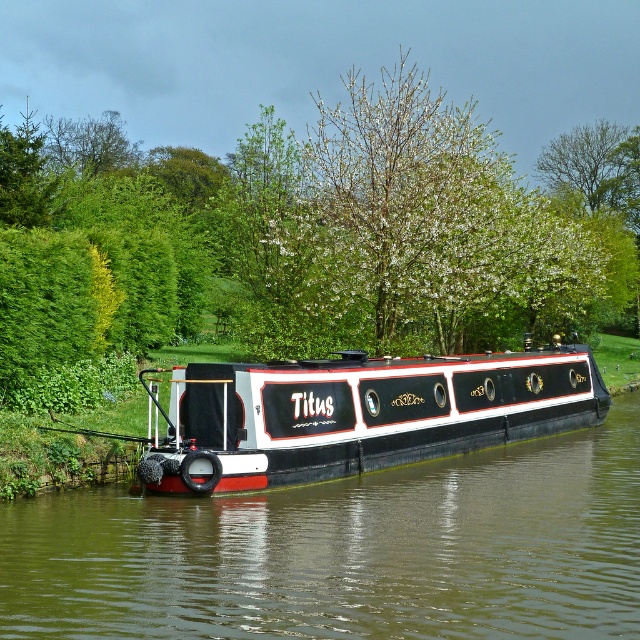
Who is positioned more to the right, green leafy tree at center or black glossy boat at center?

From the viewer's perspective, black glossy boat at center appears more on the right side.

Find the location of a particular element. This screenshot has height=640, width=640. green leafy tree at center is located at coordinates (323, 232).

Locate an element on the screen. This screenshot has width=640, height=640. green leafy tree at center is located at coordinates (323, 232).

Identify the location of green leafy tree at center. The height and width of the screenshot is (640, 640). (323, 232).

Is black glossy boat at center further to the viewer compared to green leafy tree at upper center?

No.

Between point (536, 598) and point (634, 227), which one is positioned in front?

Point (536, 598) is more forward.

This screenshot has height=640, width=640. Describe the element at coordinates (348, 552) in the screenshot. I see `black glossy boat at center` at that location.

Locate an element on the screen. black glossy boat at center is located at coordinates (348, 552).

Can you confirm if green leafy tree at center is positioned to the right of black polished wood barge at center?

No, green leafy tree at center is not to the right of black polished wood barge at center.

Between green leafy tree at center and black polished wood barge at center, which one has less height?

black polished wood barge at center

Which is behind, point (125, 193) or point (442, 404)?

Point (125, 193)

This screenshot has width=640, height=640. I want to click on green leafy tree at center, so click(x=323, y=232).